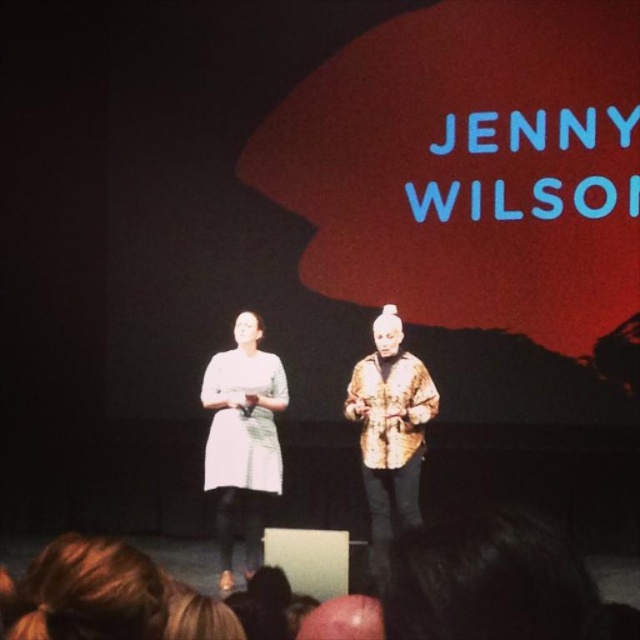
Can you confirm if matte white dress at center is smaller than floral-patterned jacket at center?

No, matte white dress at center is not smaller than floral-patterned jacket at center.

Does matte white dress at center appear under floral-patterned jacket at center?

Correct, matte white dress at center is located below floral-patterned jacket at center.

Identify the location of matte white dress at center. (243, 440).